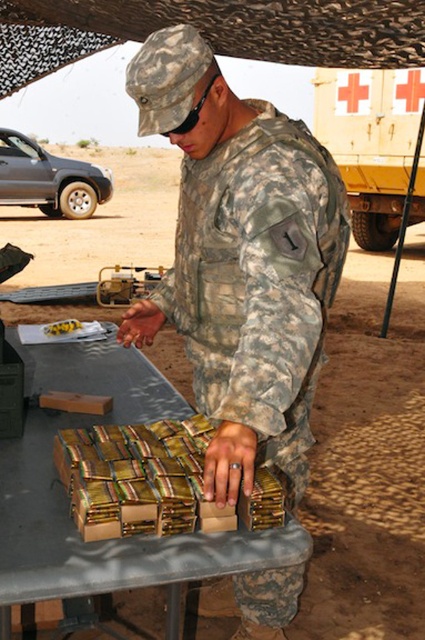
Image resolution: width=425 pixels, height=640 pixels. What do you see at coordinates (240, 259) in the screenshot? I see `camouflage uniform at center` at bounding box center [240, 259].

Which is more to the right, camouflage uniform at center or brown cardboard boxes at center?

Positioned to the right is camouflage uniform at center.

Who is more forward, (186,269) or (48,589)?

Point (48,589) is in front.

Where is `camouflage uniform at center`? The height and width of the screenshot is (640, 425). camouflage uniform at center is located at coordinates (240, 259).